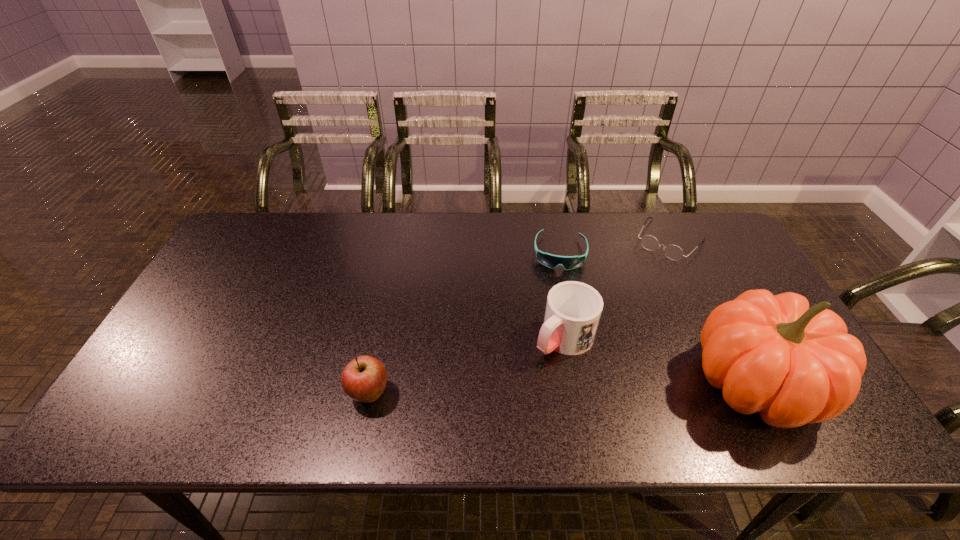
The image size is (960, 540). Find the location of `pumpkin situated at the right edge`. pumpkin situated at the right edge is located at coordinates (772, 354).

Where is `spectacles that is at the right edge`? The height and width of the screenshot is (540, 960). spectacles that is at the right edge is located at coordinates (673, 252).

Identify the location of object that is at the far right corner. (673, 252).

You are a GUI agent. You are given a task and a screenshot of the screen. Output one action in this format:
    pyautogui.click(x=<x>, y=<y>)
    Task: Click on the object that is positioned at the near right corner
    The height and width of the screenshot is (540, 960).
    Given the screenshot: What is the action you would take?
    pyautogui.click(x=772, y=354)

In the image, there is a desktop. Where is `free space at the far edge`? The width and height of the screenshot is (960, 540). free space at the far edge is located at coordinates (530, 227).

I want to click on vacant area at the right edge of the desktop, so click(713, 260).

Locate an element on the screen. The width and height of the screenshot is (960, 540). vacant area at the far left corner is located at coordinates (269, 226).

You are a GUI agent. You are given a task and a screenshot of the screen. Output one action in this format:
    pyautogui.click(x=<x>, y=<y>)
    Task: Click on the vacant space at the near left corner of the desktop
    This screenshot has width=960, height=540.
    Given the screenshot: What is the action you would take?
    pyautogui.click(x=141, y=381)

What are the coordinates of `vacant space at the far right corner of the desktop` in the screenshot? It's located at (725, 251).

You are a GUI agent. You are given a task and a screenshot of the screen. Output one action in this format:
    pyautogui.click(x=<x>, y=<y>)
    Task: Click on the vacant space that's between the apple and the spectacles
    The height and width of the screenshot is (540, 960).
    Given the screenshot: What is the action you would take?
    pyautogui.click(x=519, y=317)